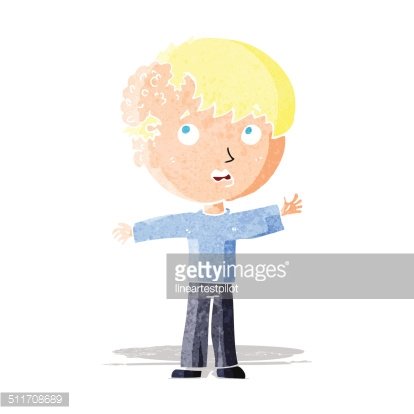
Where is `cup not in image`? cup not in image is located at coordinates (288, 206).